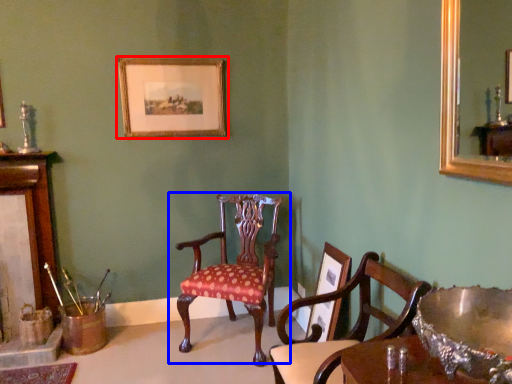
Question: Which object appears farthest to the camera in this image, picture frame (highlighted by a red box) or chair (highlighted by a blue box)?

Choices:
 (A) picture frame
 (B) chair

Answer: (A)